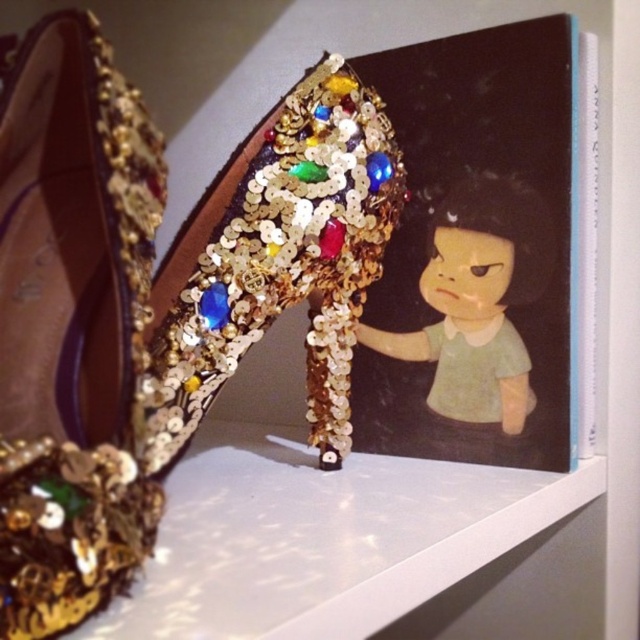
You are an interior designer arranging items on a shelf. You have a matte plastic doll at upper right and a gold sequined heel at center. Which object is positioned higher on the shelf?

The matte plastic doll at upper right is located above the gold sequined heel at center, so it is positioned higher on the shelf.

You are a store clerk arranging items on a shelf. You have a matte plastic doll at upper right and a gold sequined heel at center. Which item is positioned closer to the front of the shelf?

The matte plastic doll at upper right is closer to the viewer than the gold sequined heel at center, so the matte plastic doll at upper right is positioned closer to the front of the shelf.